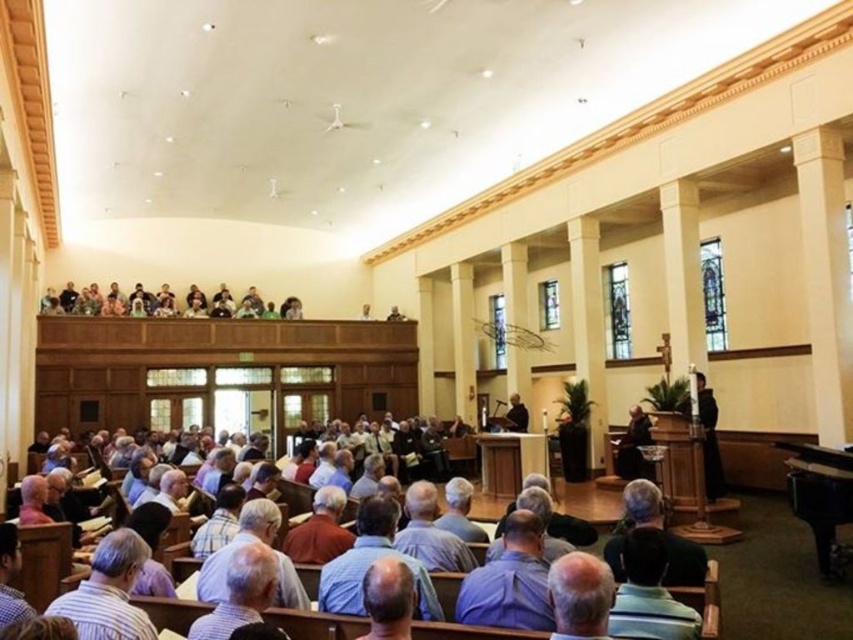
Does light brown wooden pews at lower center have a greater height compared to black smooth pulpit at center?

No, light brown wooden pews at lower center is not taller than black smooth pulpit at center.

Find the location of `light brown wooden pews at lower center`. light brown wooden pews at lower center is located at coordinates (170, 611).